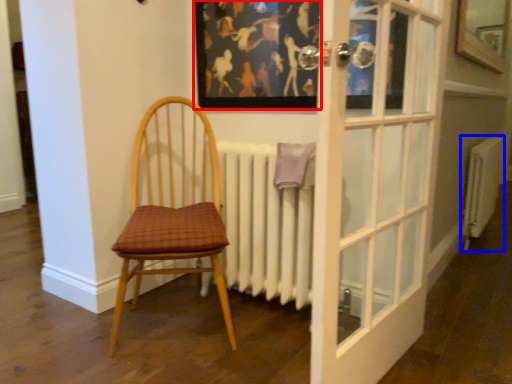
Question: Which point is closer to the camera, picture frame (highlighted by a red box) or radiator (highlighted by a blue box)?

Choices:
 (A) picture frame
 (B) radiator

Answer: (A)